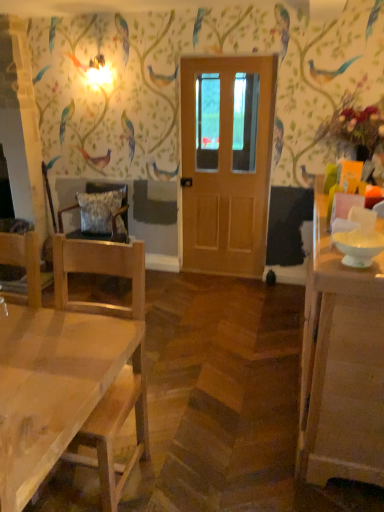
Locate an element on the screen. This screenshot has width=384, height=512. fluffy fabric pillow at left is located at coordinates (101, 212).

Measure the distance between point [382,431] and camera.

1.79 meters.

The height and width of the screenshot is (512, 384). Describe the element at coordinates (341, 365) in the screenshot. I see `white glossy cabinet at right` at that location.

You are a GUI agent. You are given a task and a screenshot of the screen. Output one action in this format:
    pyautogui.click(x=<x>, y=<y>)
    Task: Click on the wooden door at center
    
    Given the screenshot: What is the action you would take?
    pyautogui.click(x=226, y=162)

Find the location of a particular element. fluffy fabric pillow at left is located at coordinates (101, 212).

Is wooden chair with cushion at left, placed as the first chair when sorted from back to front, not near fluffy fabric pillow at left?

They are positioned close to each other.

Is the position of wooden chair with cushion at left, placed as the first chair when sorted from back to front, less distant than that of fluffy fabric pillow at left?

Yes, the depth of wooden chair with cushion at left, placed as the first chair when sorted from back to front, is less than that of fluffy fabric pillow at left.

Considering the positions of points (115, 188) and (96, 200), is point (115, 188) farther from camera compared to point (96, 200)?

That is True.

Is wooden chair with cushion at left, placed as the first chair when sorted from back to front, at the left side of fluffy fabric pillow at left?

Incorrect, wooden chair with cushion at left, placed as the first chair when sorted from back to front, is not on the left side of fluffy fabric pillow at left.

Is fluffy fabric pillow at left at the right side of wooden chair with cushion at left, the second chair when ordered from front to back?

No.

From a real-world perspective, is fluffy fabric pillow at left positioned over wooden chair with cushion at left, placed as the first chair when sorted from back to front, based on gravity?

Yes.

Is fluffy fabric pillow at left bigger or smaller than wooden chair with cushion at left, the second chair when ordered from front to back?

In the image, fluffy fabric pillow at left appears to be smaller than wooden chair with cushion at left, the second chair when ordered from front to back.

Which is in front, fluffy fabric pillow at left or wooden chair with cushion at left, the second chair when ordered from front to back?

wooden chair with cushion at left, the second chair when ordered from front to back, is in front.

You are a GUI agent. You are given a task and a screenshot of the screen. Output one action in this format:
    pyautogui.click(x=<x>, y=<y>)
    Task: Click on the door on the right of the wooden chair with cushion at left, placed as the first chair when sorted from back to front
    This screenshot has height=512, width=384.
    Given the screenshot: What is the action you would take?
    pyautogui.click(x=226, y=162)

Is point (261, 113) positioned before point (61, 219)?

That is True.

Who is bigger, wooden door at center or wooden chair with cushion at left, the second chair when ordered from front to back?

Bigger between the two is wooden chair with cushion at left, the second chair when ordered from front to back.

Is white glossy cabinet at right outside of natural wood chair at left, acting as the 2th chair starting from the back?

Indeed, white glossy cabinet at right is completely outside natural wood chair at left, acting as the 2th chair starting from the back.

Consider the image. From a real-world perspective, is white glossy cabinet at right physically below natural wood chair at left, acting as the 2th chair starting from the back?

Indeed, from a real-world perspective, white glossy cabinet at right is positioned beneath natural wood chair at left, acting as the 2th chair starting from the back.

Is white glossy cabinet at right positioned behind natural wood chair at left, acting as the 2th chair starting from the back?

Yes, it is.

Considering the sizes of objects white glossy cabinet at right and natural wood chair at left, acting as the 2th chair starting from the back, in the image provided, who is wider, white glossy cabinet at right or natural wood chair at left, acting as the 2th chair starting from the back,?

natural wood chair at left, acting as the 2th chair starting from the back.

Consider the image. Are wooden chair with cushion at left, the second chair when ordered from front to back, and wooden door at center beside each other?

wooden chair with cushion at left, the second chair when ordered from front to back, and wooden door at center are not in contact.

Can you confirm if wooden chair with cushion at left, placed as the first chair when sorted from back to front, is shorter than wooden door at center?

Indeed, wooden chair with cushion at left, placed as the first chair when sorted from back to front, has a lesser height compared to wooden door at center.

From the image's perspective, is wooden chair with cushion at left, placed as the first chair when sorted from back to front, over wooden door at center?

No.

Which of these two, wooden door at center or fluffy fabric pillow at left, is wider?

fluffy fabric pillow at left is wider.

Considering the positions of objects wooden door at center and fluffy fabric pillow at left in the image provided, who is in front, wooden door at center or fluffy fabric pillow at left?

wooden door at center is more forward.

Is wooden door at center surrounding fluffy fabric pillow at left?

Actually, fluffy fabric pillow at left is outside wooden door at center.

Between white glossy cabinet at right and wooden door at center, which one has larger width?

With larger width is white glossy cabinet at right.

Considering the relative positions of white glossy cabinet at right and wooden door at center in the image provided, is white glossy cabinet at right to the left of wooden door at center from the viewer's perspective?

No.

Is white glossy cabinet at right closer to camera compared to wooden door at center?

Yes, it is.

At what (x,y) coordinates should I click in order to perform the action: click on the 1st chair counting from the right side of the fluffy fabric pillow at left. Please return your answer as a coordinate pair (x, y). Looking at the image, I should click on (111, 190).

This screenshot has height=512, width=384. Find the location of `pillow that is behind the wooden chair with cushion at left, placed as the first chair when sorted from back to front`. pillow that is behind the wooden chair with cushion at left, placed as the first chair when sorted from back to front is located at coordinates (101, 212).

Estimate the real-world distances between objects in this image. Which object is closer to natural wood chair at left, acting as the 2th chair starting from the back, wooden door at center or wooden chair with cushion at left, the second chair when ordered from front to back?

wooden chair with cushion at left, the second chair when ordered from front to back.

Considering their positions, is wooden door at center positioned closer to natural wood chair at left, acting as the 2th chair starting from the back, than fluffy fabric pillow at left?

Based on the image, fluffy fabric pillow at left appears to be nearer to natural wood chair at left, acting as the 2th chair starting from the back.

From the image, which object appears to be farther from wooden chair with cushion at left, the second chair when ordered from front to back, wooden door at center or white glossy cabinet at right?

white glossy cabinet at right lies further to wooden chair with cushion at left, the second chair when ordered from front to back, than the other object.

Consider the image. Which object lies nearer to the anchor point white glossy cabinet at right, fluffy fabric pillow at left or natural wood chair at left, arranged as the 1th chair when viewed from the front?

natural wood chair at left, arranged as the 1th chair when viewed from the front, lies closer to white glossy cabinet at right than the other object.

Looking at the image, which one is located further to white glossy cabinet at right, natural wood chair at left, acting as the 2th chair starting from the back, or wooden chair with cushion at left, the second chair when ordered from front to back?

wooden chair with cushion at left, the second chair when ordered from front to back, is positioned further to the anchor white glossy cabinet at right.

Based on the photo, considering their positions, is natural wood chair at left, arranged as the 1th chair when viewed from the front, positioned closer to wooden chair with cushion at left, placed as the first chair when sorted from back to front, than fluffy fabric pillow at left?

fluffy fabric pillow at left is positioned closer to the anchor wooden chair with cushion at left, placed as the first chair when sorted from back to front.

Estimate the real-world distances between objects in this image. Which object is closer to wooden door at center, wooden chair with cushion at left, placed as the first chair when sorted from back to front, or fluffy fabric pillow at left?

fluffy fabric pillow at left.

Estimate the real-world distances between objects in this image. Which object is closer to natural wood chair at left, arranged as the 1th chair when viewed from the front, white glossy cabinet at right or wooden chair with cushion at left, the second chair when ordered from front to back?

white glossy cabinet at right is positioned closer to the anchor natural wood chair at left, arranged as the 1th chair when viewed from the front.

I want to click on cabinetry between natural wood chair at left, acting as the 2th chair starting from the back, and wooden door at center in the front-back direction, so click(341, 365).

In order to click on chair positioned between white glossy cabinet at right and fluffy fabric pillow at left from near to far in this screenshot , I will do `click(111, 190)`.

This screenshot has height=512, width=384. Identify the location of door between natural wood chair at left, arranged as the 1th chair when viewed from the front, and fluffy fabric pillow at left from front to back. (226, 162).

This screenshot has width=384, height=512. I want to click on door between white glossy cabinet at right and fluffy fabric pillow at left from front to back, so click(x=226, y=162).